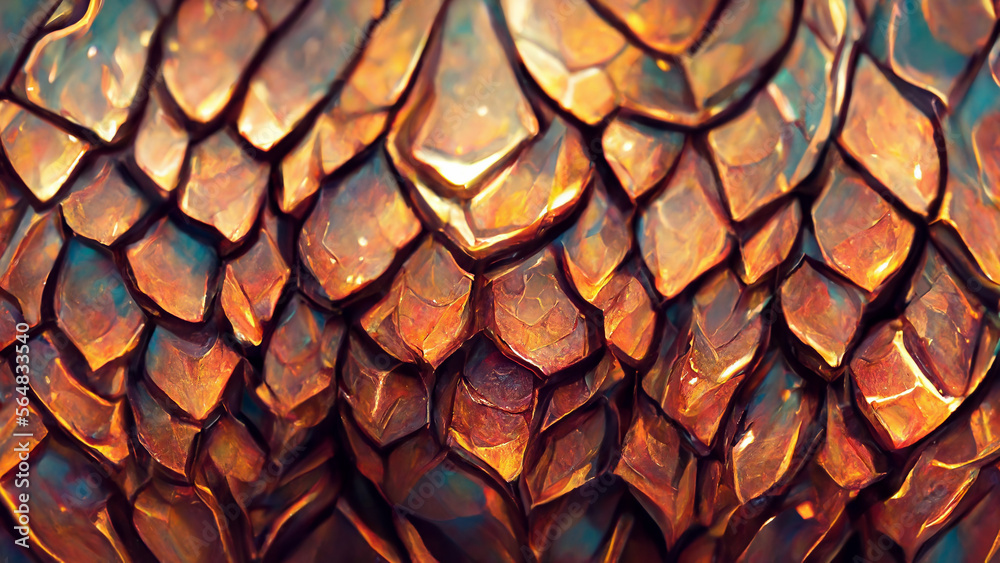
In order to click on artwork in this screenshot , I will do `click(515, 245)`.